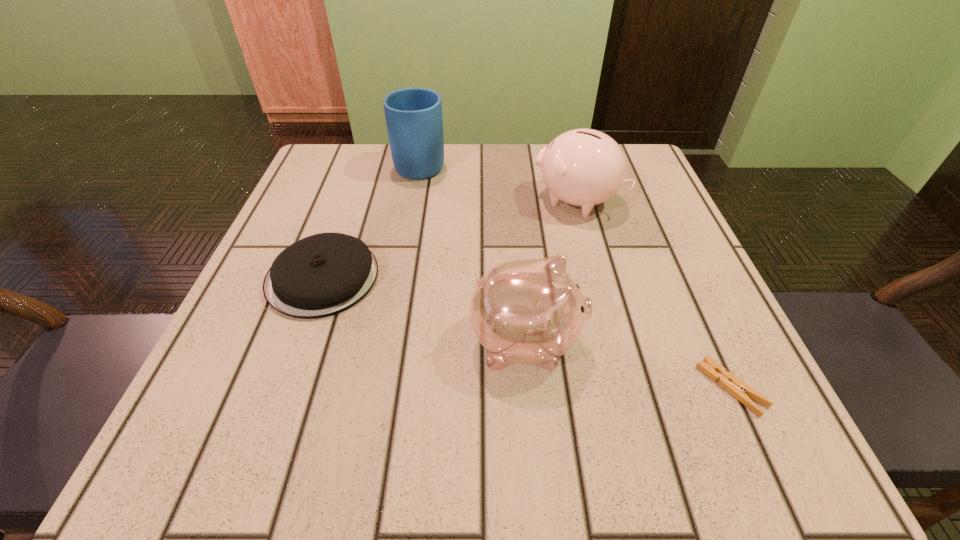
Locate an element on the screen. mug is located at coordinates (414, 121).

Where is `the farther piggy bank`? This screenshot has width=960, height=540. the farther piggy bank is located at coordinates (584, 167).

Identify the location of the nearer piggy bank. The width and height of the screenshot is (960, 540). (530, 311).

Find the location of a particular element. pancake is located at coordinates (324, 274).

This screenshot has width=960, height=540. Find the location of `the shortest object`. the shortest object is located at coordinates (740, 390).

What are the coordinates of `the rightmost object` in the screenshot? It's located at (740, 390).

Where is `free space located 0.060m on the left of the farther piggy bank`? free space located 0.060m on the left of the farther piggy bank is located at coordinates (504, 200).

What are the coordinates of `vacant space located 0.050m on the front facing side of the nearer piggy bank` in the screenshot? It's located at (616, 342).

The image size is (960, 540). What are the coordinates of `vacant area located 0.070m on the back of the second shortest object` in the screenshot? It's located at (344, 219).

You are a GUI agent. You are given a task and a screenshot of the screen. Output one action in this format:
    pyautogui.click(x=<x>, y=<y>)
    Task: Click on the free space located 0.340m on the back of the clothespin
    
    Given the screenshot: What is the action you would take?
    pyautogui.click(x=653, y=215)